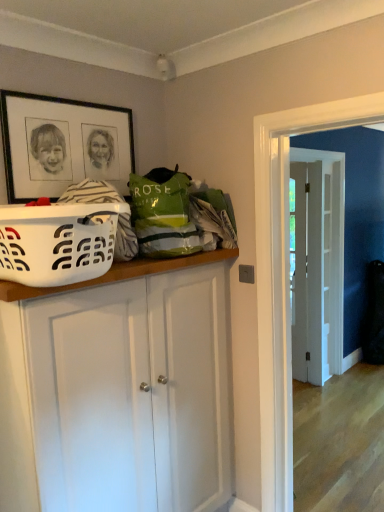
Question: Does white wooden door at center have a lesser height compared to white matte cabinet at center?

Choices:
 (A) yes
 (B) no

Answer: (B)

Question: Is white wooden door at center to the right of white matte cabinet at center from the viewer's perspective?

Choices:
 (A) yes
 (B) no

Answer: (A)

Question: Considering the relative sizes of white wooden door at center and white matte cabinet at center in the image provided, is white wooden door at center thinner than white matte cabinet at center?

Choices:
 (A) yes
 (B) no

Answer: (B)

Question: Is white wooden door at center positioned behind white matte cabinet at center?

Choices:
 (A) yes
 (B) no

Answer: (A)

Question: Would you say white wooden door at center is a long distance from white matte cabinet at center?

Choices:
 (A) no
 (B) yes

Answer: (B)

Question: Looking at their shapes, would you say white matte cabinet at center is wider or thinner than white wooden door at center?

Choices:
 (A) wide
 (B) thin

Answer: (B)

Question: Is point (99, 445) positioned closer to the camera than point (309, 290)?

Choices:
 (A) farther
 (B) closer

Answer: (B)

Question: Is white matte cabinet at center taller or shorter than white wooden door at center?

Choices:
 (A) short
 (B) tall

Answer: (A)

Question: Is white matte cabinet at center in front of or behind white wooden door at center in the image?

Choices:
 (A) behind
 (B) front

Answer: (B)

Question: Is white wooden door at center in front of or behind white matte cabinet at center in the image?

Choices:
 (A) front
 (B) behind

Answer: (B)

Question: Looking at the image, does white wooden door at center seem bigger or smaller compared to white matte cabinet at center?

Choices:
 (A) small
 (B) big

Answer: (B)

Question: Considering the positions of white wooden door at center and white matte cabinet at center in the image, is white wooden door at center wider or thinner than white matte cabinet at center?

Choices:
 (A) wide
 (B) thin

Answer: (A)

Question: From a real-world perspective, is white wooden door at center positioned above or below white matte cabinet at center?

Choices:
 (A) above
 (B) below

Answer: (A)

Question: From a real-world perspective, is black matte picture frame at upper left physically located above or below white wooden door at center?

Choices:
 (A) above
 (B) below

Answer: (A)

Question: Is black matte picture frame at upper left inside the boundaries of white wooden door at center, or outside?

Choices:
 (A) inside
 (B) outside

Answer: (B)